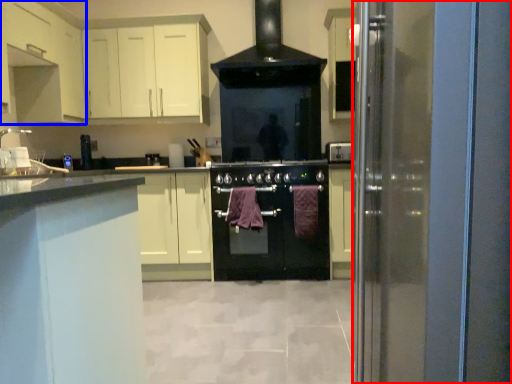
Question: Which point is closer to the camera, glass door (highlighted by a red box) or cabinetry (highlighted by a blue box)?

Choices:
 (A) glass door
 (B) cabinetry

Answer: (A)